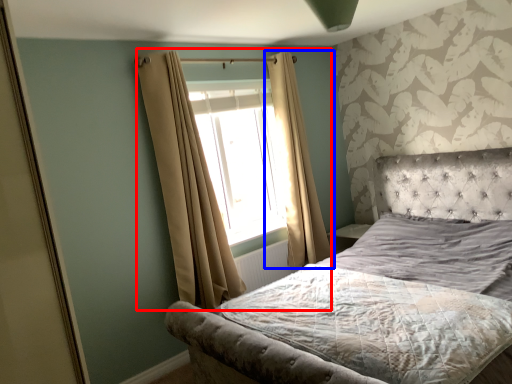
Question: Among these objects, which one is nearest to the camera, curtain (highlighted by a red box) or curtain (highlighted by a blue box)?

Choices:
 (A) curtain
 (B) curtain

Answer: (A)